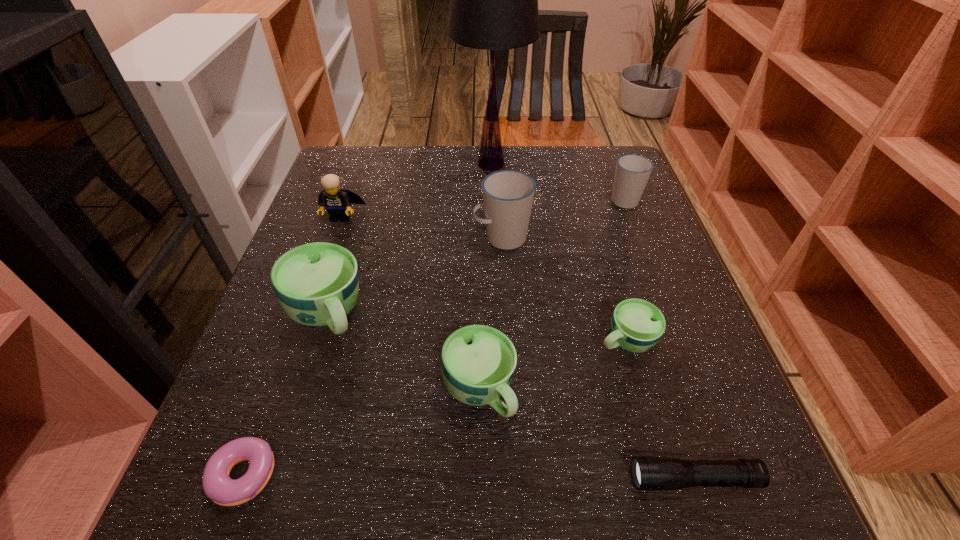
Identify which object is the fourth closest to the Lego. Please provide its 2D coordinates. Your answer should be formatted as a tuple, i.e. [(x, y)], where the tuple contains the x and y coordinates of a point satisfying the conditions above.

[(478, 362)]

Image resolution: width=960 pixels, height=540 pixels. I want to click on the closest object relative to the Lego, so click(x=317, y=284).

What are the coordinates of `cup that is the closest one to the smaller white cup` in the screenshot? It's located at tap(508, 195).

Where is `the fourth closest cup to the fourth tallest cup`? This screenshot has width=960, height=540. the fourth closest cup to the fourth tallest cup is located at coordinates (632, 172).

Locate which blue cup is the third closest to the lampshade. Please provide its 2D coordinates. Your answer should be formatted as a tuple, i.e. [(x, y)], where the tuple contains the x and y coordinates of a point satisfying the conditions above.

[(478, 362)]

Identify which blue cup is located as the nearest to the second smallest blue cup. Please provide its 2D coordinates. Your answer should be formatted as a tuple, i.e. [(x, y)], where the tuple contains the x and y coordinates of a point satisfying the conditions above.

[(636, 325)]

Find the location of a particular element. This screenshot has height=540, width=960. free location that satisfies the following two spatial constraints: 1. on the front-facing side of the Lego; 2. on the right side of the fourth tallest cup is located at coordinates (279, 390).

In order to click on vacant area in the image that satisfies the following two spatial constraints: 1. on the front-facing side of the lampshade; 2. on the back side of the seventh tallest object in this screenshot , I will do `click(496, 340)`.

Where is `vacant region that satisfies the following two spatial constraints: 1. on the front-facing side of the Lego; 2. on the left side of the second biggest blue cup`? Image resolution: width=960 pixels, height=540 pixels. vacant region that satisfies the following two spatial constraints: 1. on the front-facing side of the Lego; 2. on the left side of the second biggest blue cup is located at coordinates (279, 390).

The width and height of the screenshot is (960, 540). What are the coordinates of `free spot that satisfies the following two spatial constraints: 1. with a handle on the side of the fourth nearest cup; 2. on the back side of the rightmost blue cup` in the screenshot? It's located at (507, 340).